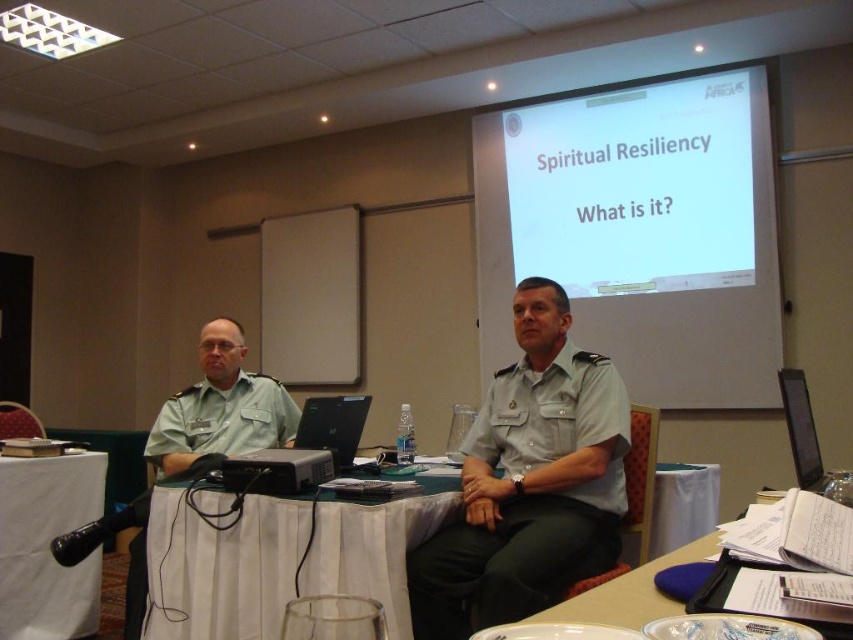
Question: Which object appears closest to the camera in this image?

Choices:
 (A) white paper at lower right
 (B) matte green uniform at center
 (C) white cloth table at lower left

Answer: (A)

Question: Considering the relative positions of light gray uniform at center and matte green uniform at center in the image provided, where is light gray uniform at center located with respect to matte green uniform at center?

Choices:
 (A) left
 (B) right

Answer: (B)

Question: Considering the real-world distances, which object is farthest from the light gray uniform at center?

Choices:
 (A) white cloth-covered table at center
 (B) white cloth table at lower left
 (C) silver metallic laptop at center

Answer: (B)

Question: Is white cloth-covered table at center to the right of white paper at lower right from the viewer's perspective?

Choices:
 (A) yes
 (B) no

Answer: (B)

Question: Can you confirm if white matte projection screen at upper center is positioned to the left of white cloth table at lower left?

Choices:
 (A) yes
 (B) no

Answer: (B)

Question: Which point is farther to the camera?

Choices:
 (A) (334, 419)
 (B) (141, 604)

Answer: (A)